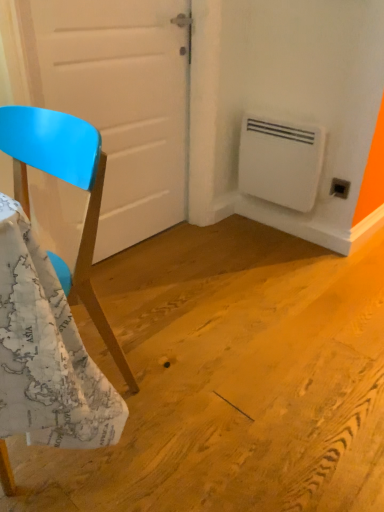
Where is `free space in front of white matte door at center`? free space in front of white matte door at center is located at coordinates (156, 302).